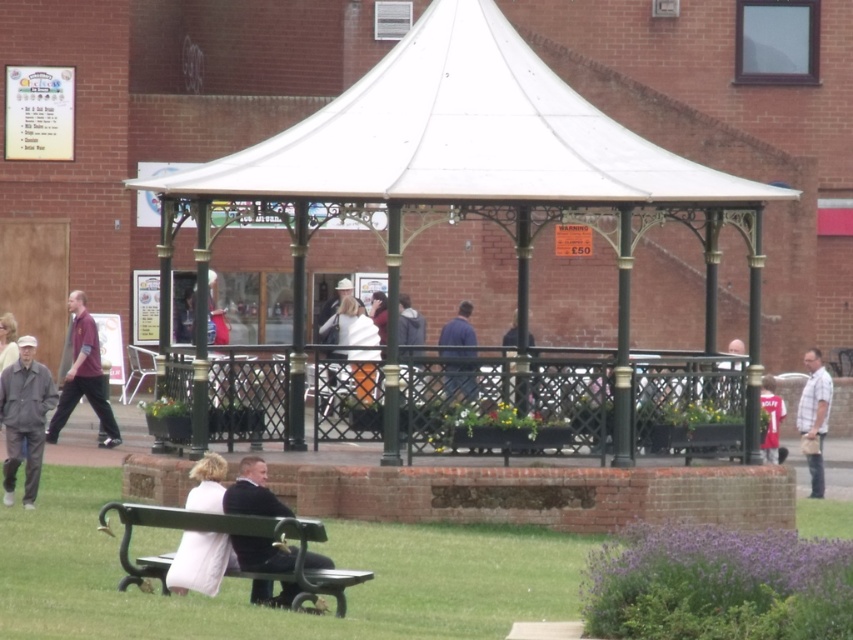
Question: Which object is closer to the camera taking this photo?

Choices:
 (A) dark suit at center
 (B) dark blue fabric jacket at center
 (C) white fabric jacket at center
 (D) maroon fabric shirt at left

Answer: (A)

Question: Which point appears closest to the camera in this image?

Choices:
 (A) (102, 397)
 (B) (218, 476)
 (C) (370, 321)
 (D) (132, 506)

Answer: (D)

Question: Can you confirm if white plaid shirt at right is thinner than dark blue fabric jacket at center?

Choices:
 (A) yes
 (B) no

Answer: (B)

Question: Which point appears closest to the camera in this image?

Choices:
 (A) (80, 344)
 (B) (515, 342)

Answer: (A)

Question: From the image, what is the correct spatial relationship of white fabric canopy at center in relation to green painted wood bench at lower left?

Choices:
 (A) below
 (B) above

Answer: (B)

Question: Does white fabric canopy at center have a smaller size compared to matte red jersey at right?

Choices:
 (A) no
 (B) yes

Answer: (A)